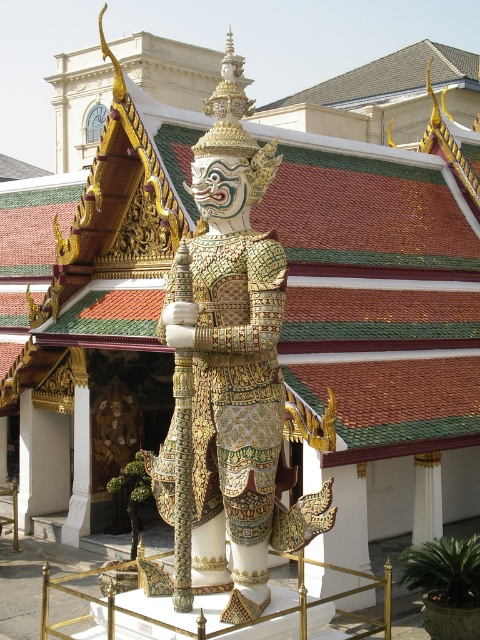
You are an architect visiting a traditional Thai temple. You notice the gold textured armor at center and the white marble pillar at center. Which object is taller?

The gold textured armor at center is taller than the white marble pillar at center.

Consider the image. You are a photographer standing at a certain distance from the gold textured armor at center. You want to capture a clear photo of the armor without any distortion. Considering the statue is on a pedestal with a low golden railing, what is the minimum distance you should maintain from the armor to ensure clarity and avoid distortion?

To capture a clear photo of the gold textured armor at center without distortion, you should maintain a distance of at least 20.06 meters from the armor, as this is the distance between the camera and the armor in the scene.

You are an architect inspecting the statue and its pedestal. You notice the gold textured armor at center and the white marble pillar at center. Which object is positioned higher in the scene?

The gold textured armor at center is located above the white marble pillar at center, so it is positioned higher in the scene.